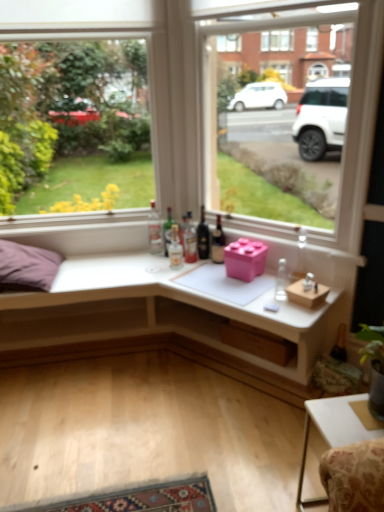
Locate an element on the screen. free spot in front of dark glass bottle at center, the 6th bottle viewed from the left is located at coordinates (210, 273).